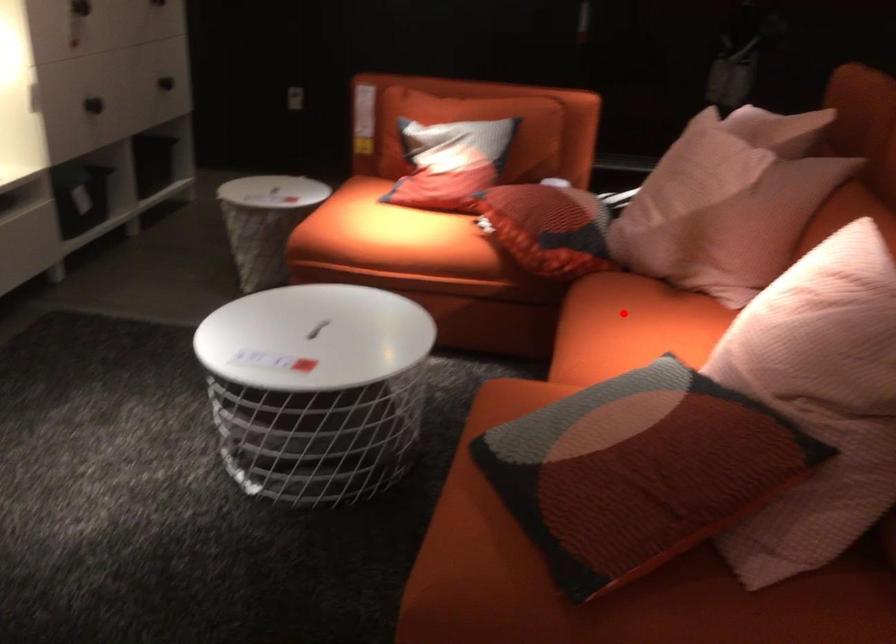
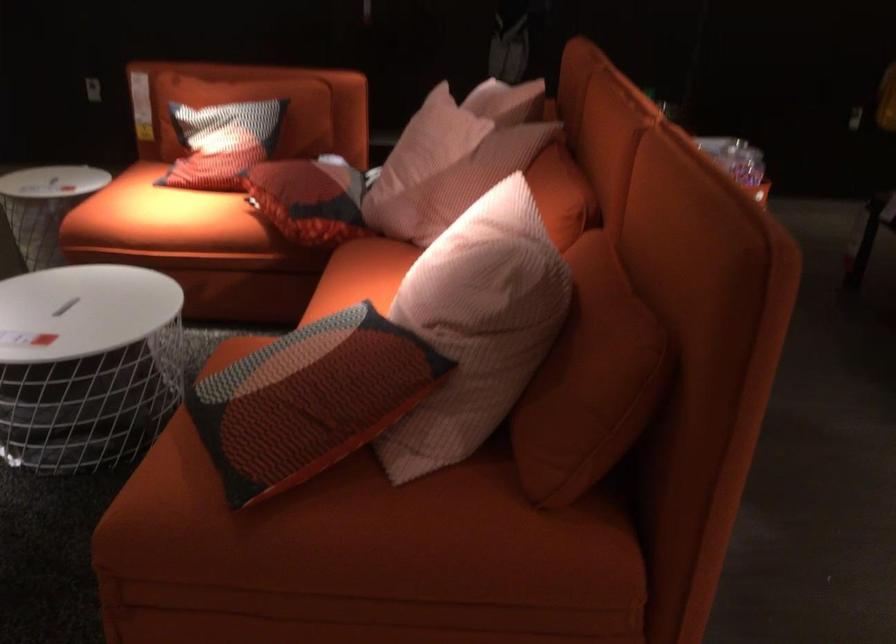
Question: I am providing you with two images of the same scene from different viewpoints. A red point is shown in image1. For the corresponding object point in image2, is it positioned nearer or farther from the camera?

Choices:
 (A) Nearer
 (B) Farther

Answer: (B)